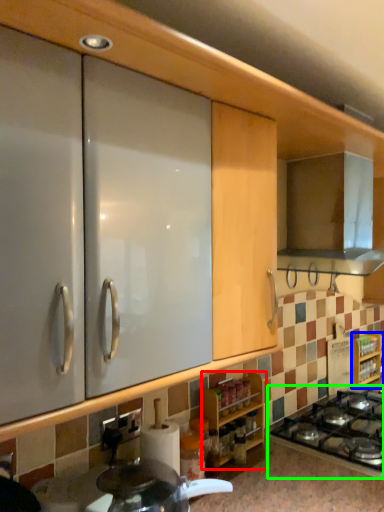
Question: Which object is positioned closest to cabinetry (highlighted by a red box)? Select from cabinetry (highlighted by a blue box) and gas stove (highlighted by a green box).

Choices:
 (A) cabinetry
 (B) gas stove

Answer: (B)